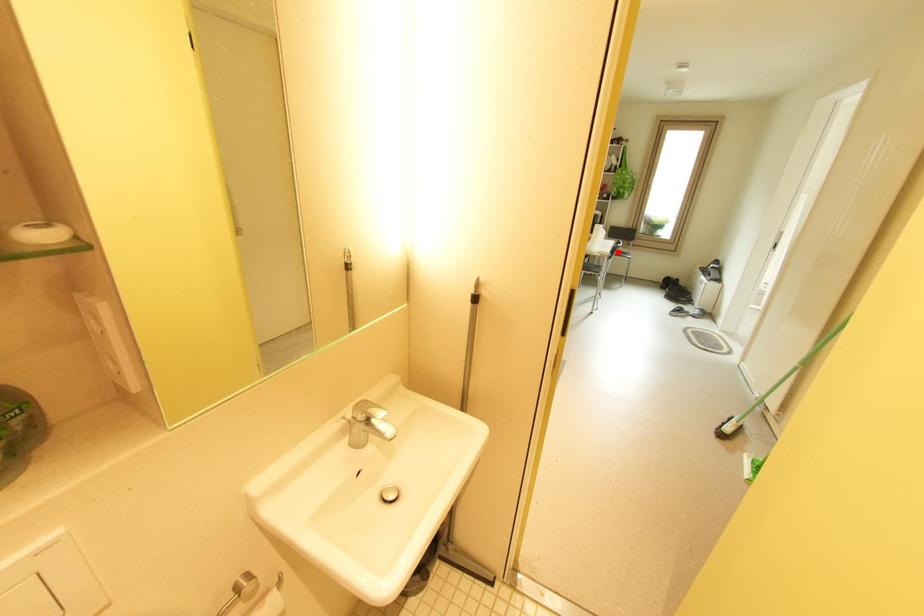
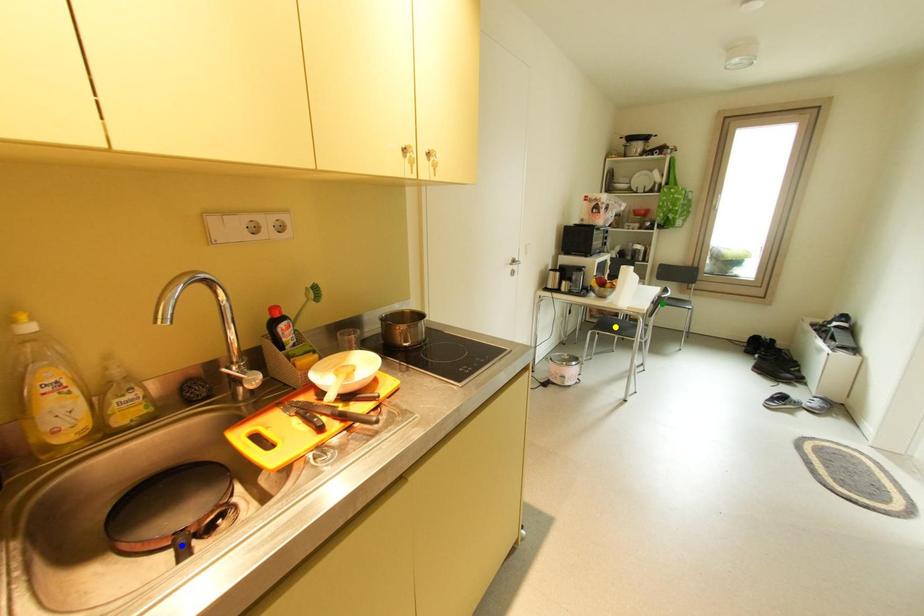
Question: I am providing you with two images of the same scene from different viewpoints. A red point is marked on the first image. You are given multiple points on the second image. Which point in image 2 represents the same 3d spot as the red point in image 1?

Choices:
 (A) blue point
 (B) green point
 (C) yellow point

Answer: (B)